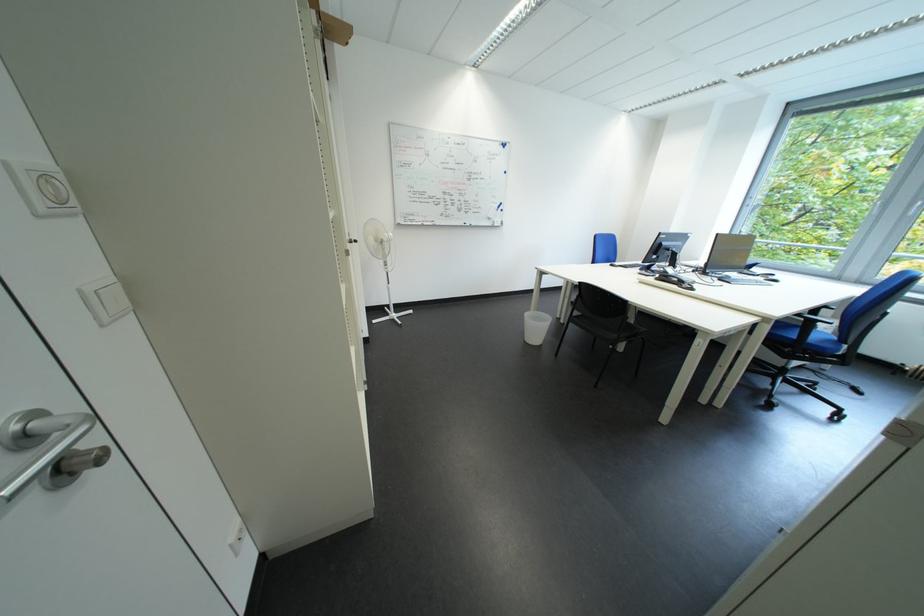
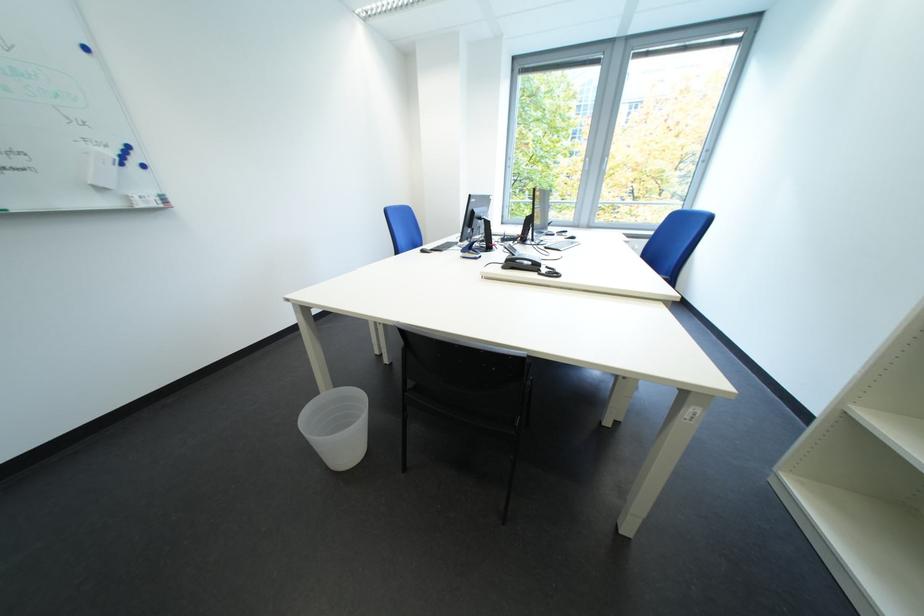
Locate, in the second image, the point that corresponds to pixel 676 281 in the first image.

(524, 265)